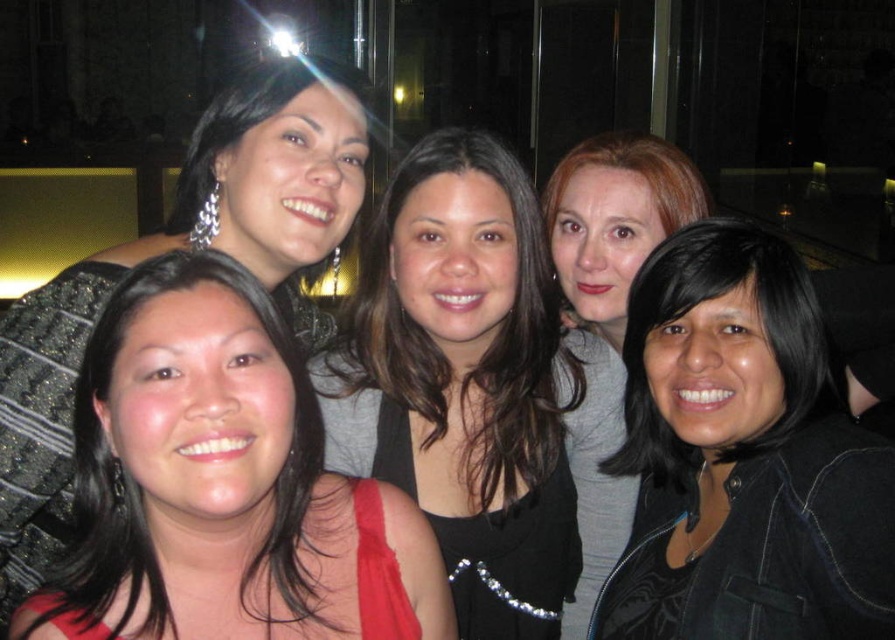
Can you confirm if shiny black dress at lower left is taller than black matte jacket at lower right?

No, shiny black dress at lower left is not taller than black matte jacket at lower right.

Does point (124, 314) lie in front of point (729, 413)?

Yes.

Identify the location of shiny black dress at lower left. This screenshot has height=640, width=895. (226, 483).

Does shiny black dress at lower left appear over shiny black hair at center?

Actually, shiny black dress at lower left is below shiny black hair at center.

You are a GUI agent. You are given a task and a screenshot of the screen. Output one action in this format:
    pyautogui.click(x=<x>, y=<y>)
    Task: Click on the shiny black dress at lower left
    The width and height of the screenshot is (895, 640).
    Given the screenshot: What is the action you would take?
    pos(226,483)

Can you confirm if black matte jacket at lower right is positioned to the right of shiny black hair at center?

Correct, you'll find black matte jacket at lower right to the right of shiny black hair at center.

Between black matte jacket at lower right and shiny black hair at center, which one is positioned lower?

black matte jacket at lower right is below.

This screenshot has width=895, height=640. What are the coordinates of `black matte jacket at lower right` in the screenshot? It's located at (743, 458).